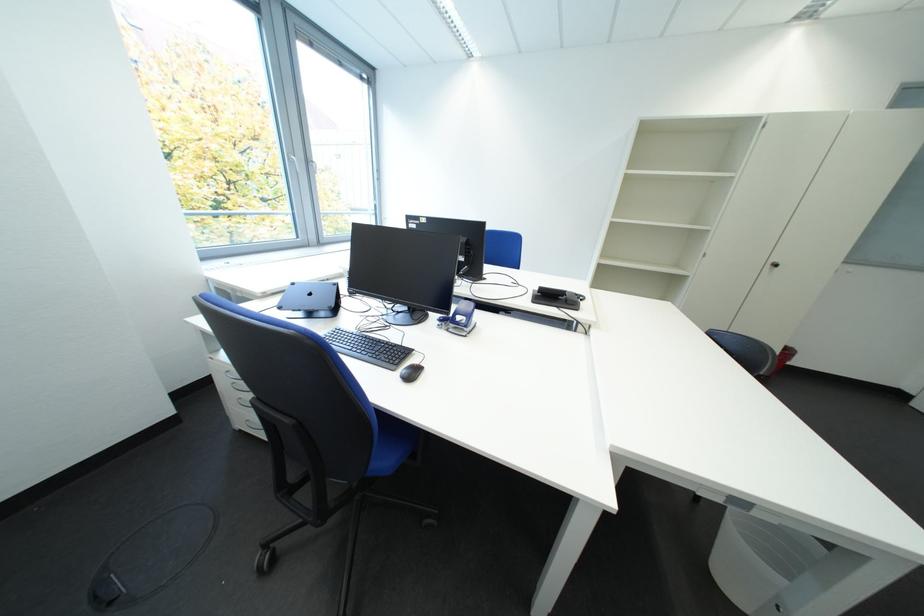
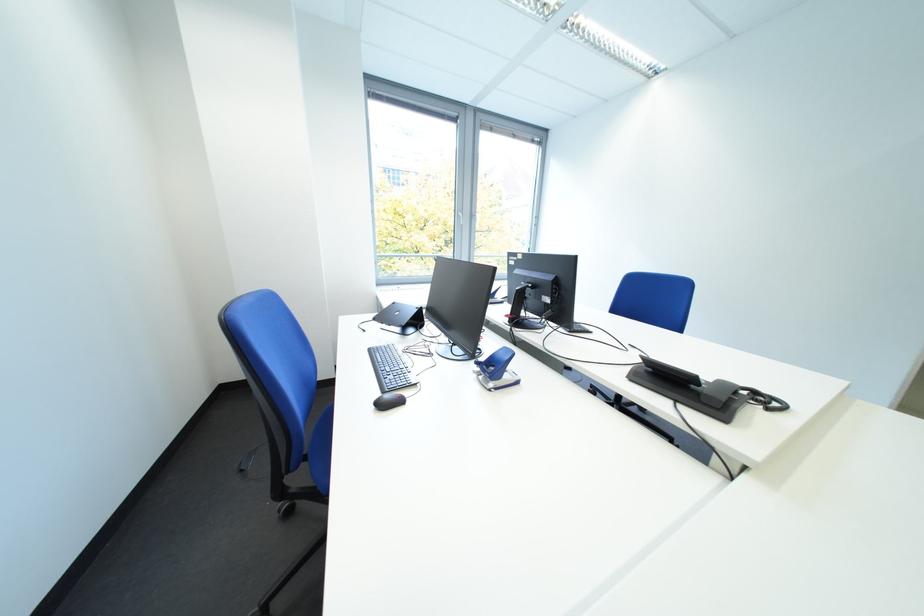
Question: The first image is from the beginning of the video and the second image is from the end. How did the camera likely rotate when shooting the video?

Choices:
 (A) Left
 (B) Right
 (C) Up
 (D) Down

Answer: (A)